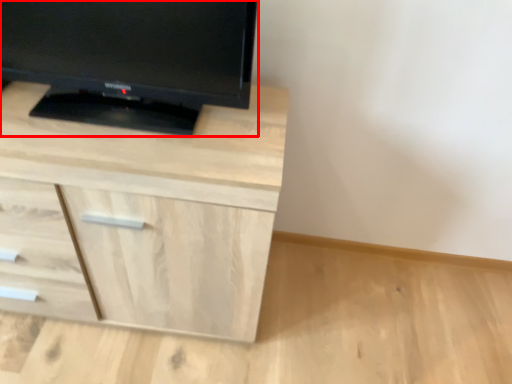
Question: From the image's perspective, what is the correct spatial relationship of television (annotated by the red box) in relation to chest of drawers?

Choices:
 (A) below
 (B) above

Answer: (B)